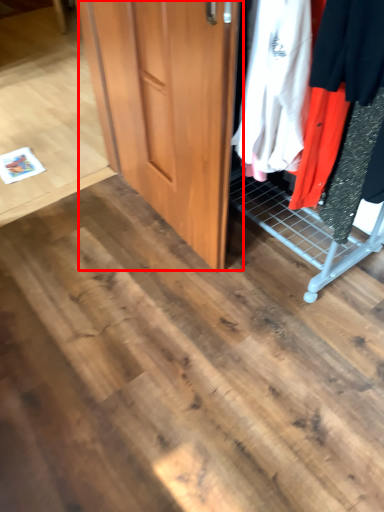
Question: From the image's perspective, considering the relative positions of door (annotated by the red box) and closet in the image provided, where is door (annotated by the red box) located with respect to the staircase?

Choices:
 (A) below
 (B) above

Answer: (A)